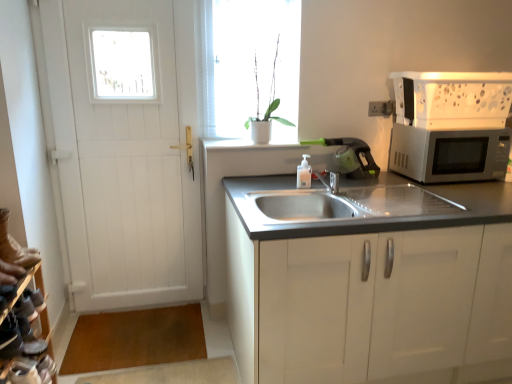
Image resolution: width=512 pixels, height=384 pixels. What do you see at coordinates (23, 371) in the screenshot?
I see `leather shoe at lower left` at bounding box center [23, 371].

Measure the distance between leather shoe at lower left and camera.

The distance of leather shoe at lower left from camera is 5.10 feet.

Measure the distance between point (14, 341) and camera.

The depth of point (14, 341) is 1.60 meters.

Identify the location of leather shoe rack at lower left. (24, 333).

Identify the location of leather shoe at lower left. This screenshot has height=384, width=512. (23, 371).

In terms of width, does white matte pot at upper center look wider or thinner when compared to white wooden door at left?

Considering their sizes, white matte pot at upper center looks broader than white wooden door at left.

Between white matte pot at upper center and white wooden door at left, which one appears on the left side from the viewer's perspective?

white wooden door at left.

How many degrees apart are the facing directions of white matte pot at upper center and white wooden door at left?

There is a 0.806-degree angle between the facing directions of white matte pot at upper center and white wooden door at left.

From the picture: Would you say white matte pot at upper center is outside white wooden door at left?

white matte pot at upper center lies outside white wooden door at left's area.

Is silver metallic microwave at right a part of white matte plant at upper center?

No, silver metallic microwave at right is located outside of white matte plant at upper center.

Considering the positions of objects white matte plant at upper center and silver metallic microwave at right in the image provided, who is more to the left, white matte plant at upper center or silver metallic microwave at right?

From the viewer's perspective, white matte plant at upper center appears more on the left side.

At what (x,y) coordinates should I click in order to perform the action: click on window behind the silver metallic microwave at right. Please return your answer as a coordinate pair (x, y). The height and width of the screenshot is (384, 512). Looking at the image, I should click on (248, 63).

Based on the photo, is white leather running shoe at lower left oriented towards leather shoe at lower left?

No, white leather running shoe at lower left is not turned towards leather shoe at lower left.

From the image's perspective, relative to leather shoe at lower left, is white leather running shoe at lower left above or below?

Based on their image positions, white leather running shoe at lower left is located above leather shoe at lower left.

In terms of height, does white leather running shoe at lower left look taller or shorter compared to leather shoe at lower left?

In the image, white leather running shoe at lower left appears to be taller than leather shoe at lower left.

How different are the orientations of white leather running shoe at lower left and leather shoe at lower left in degrees?

7.72 degrees.

Considering the sizes of objects white matte plant at upper center and white matte pot at upper center in the image provided, who is smaller, white matte plant at upper center or white matte pot at upper center?

Smaller between the two is white matte plant at upper center.

Considering the relative sizes of white matte plant at upper center and white matte pot at upper center in the image provided, is white matte plant at upper center thinner than white matte pot at upper center?

Indeed, white matte plant at upper center has a lesser width compared to white matte pot at upper center.

Considering the positions of objects white matte plant at upper center and white matte pot at upper center in the image provided, who is more to the left, white matte plant at upper center or white matte pot at upper center?

Positioned to the left is white matte plant at upper center.

From a real-world perspective, is white matte plant at upper center physically below white matte pot at upper center?

No, from a real-world perspective, white matte plant at upper center is not below white matte pot at upper center.

Is white matte plant at upper center further to the viewer compared to white wooden door at left?

Yes, it is.

From the picture: Is white matte plant at upper center situated inside white wooden door at left or outside?

white matte plant at upper center exists outside the volume of white wooden door at left.

Considering the relative positions of white matte plant at upper center and white wooden door at left in the image provided, is white matte plant at upper center to the right of white wooden door at left from the viewer's perspective?

Yes, white matte plant at upper center is to the right of white wooden door at left.

Is white smooth window sill at upper center further to the viewer compared to leather shoe at lower left?

Yes, white smooth window sill at upper center is further from the viewer.

Who is smaller, white smooth window sill at upper center or leather shoe at lower left?

leather shoe at lower left is smaller.

Does white smooth window sill at upper center appear on the right side of leather shoe at lower left?

Yes.

Which is in front, point (211, 16) or point (30, 372)?

The point (30, 372) is in front.

Can you confirm if white matte plant at upper center is positioned to the right of leather shoe at lower left?

Yes.

From a real-world perspective, is white matte plant at upper center above or below leather shoe at lower left?

From a real-world perspective, white matte plant at upper center is physically above leather shoe at lower left.

This screenshot has height=384, width=512. I want to click on door beneath the white matte pot at upper center (from a real-world perspective), so click(x=126, y=157).

You are a GUI agent. You are given a task and a screenshot of the screen. Output one action in this format:
    pyautogui.click(x=<x>, y=<y>)
    Task: Click on the microwave oven that is on the right side of white matte plant at upper center
    The height and width of the screenshot is (384, 512).
    Given the screenshot: What is the action you would take?
    pyautogui.click(x=449, y=154)

Looking at the image, which one is located closer to white matte cabinet at center, leather shoe rack at lower left or white matte pot at upper center?

white matte pot at upper center is positioned closer to the anchor white matte cabinet at center.

From the image, which object appears to be nearer to white matte cabinet at center, leather shoe at lower left or leather shoe rack at lower left?

leather shoe rack at lower left.

Looking at the image, which one is located further to white wooden door at left, white smooth window sill at upper center or white leather running shoe at lower left?

white leather running shoe at lower left.

Estimate the real-world distances between objects in this image. Which object is closer to white leather running shoe at lower left, white wooden door at left or silver metallic microwave at right?

white wooden door at left lies closer to white leather running shoe at lower left than the other object.

Estimate the real-world distances between objects in this image. Which object is further from white wooden door at left, leather shoe rack at lower left or leather shoe at lower left?

leather shoe at lower left is further to white wooden door at left.

Looking at this image, which object lies further to the anchor point silver metallic microwave at right, white wooden door at left or white leather running shoe at lower left?

white leather running shoe at lower left lies further to silver metallic microwave at right than the other object.

In the scene shown: Considering their positions, is leather shoe at lower left positioned further to white smooth window sill at upper center than white matte plant at upper center?

leather shoe at lower left lies further to white smooth window sill at upper center than the other object.

Which object lies nearer to the anchor point white smooth window sill at upper center, white wooden door at left or leather shoe rack at lower left?

white wooden door at left.

Find the location of a particular element. The height and width of the screenshot is (384, 512). window sill located between white wooden door at left and white matte cabinet at center in the left-right direction is located at coordinates (260, 145).

I want to click on door situated between white leather running shoe at lower left and white matte plant at upper center from left to right, so click(x=126, y=157).

In order to click on shelf between white leather running shoe at lower left and leather shoe at lower left from top to bottom in this screenshot , I will do `click(24, 333)`.

Where is `window sill between white matte plant at upper center and leather shoe at lower left from top to bottom`? The width and height of the screenshot is (512, 384). window sill between white matte plant at upper center and leather shoe at lower left from top to bottom is located at coordinates (260, 145).